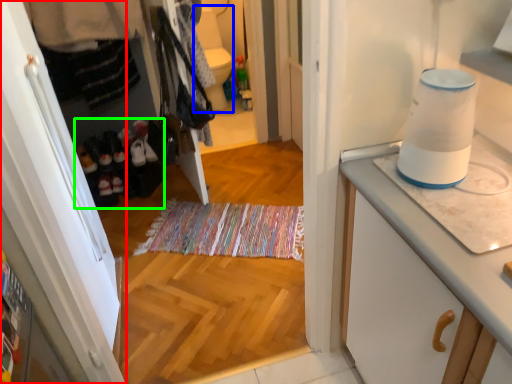
Question: Which object is positioned closest to cabinetry (highlighted by a red box)? Select from toilet bowl (highlighted by a blue box) and footwear (highlighted by a green box).

Choices:
 (A) toilet bowl
 (B) footwear

Answer: (B)